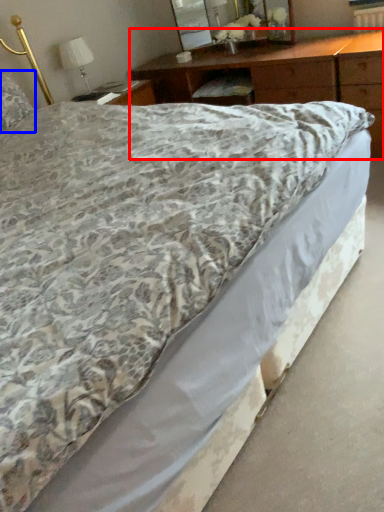
Question: Which of the following is the closest to the observer, nightstand (highlighted by a red box) or pillow (highlighted by a blue box)?

Choices:
 (A) nightstand
 (B) pillow

Answer: (A)